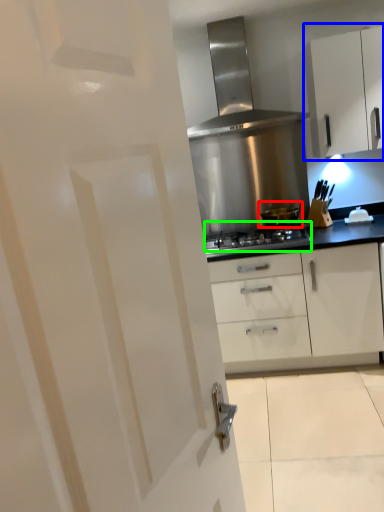
Question: Which object is the closest to the kitchen appliance (highlighted by a red box)? Choose among these: cabinetry (highlighted by a blue box) or gas stove (highlighted by a green box).

Choices:
 (A) cabinetry
 (B) gas stove

Answer: (B)